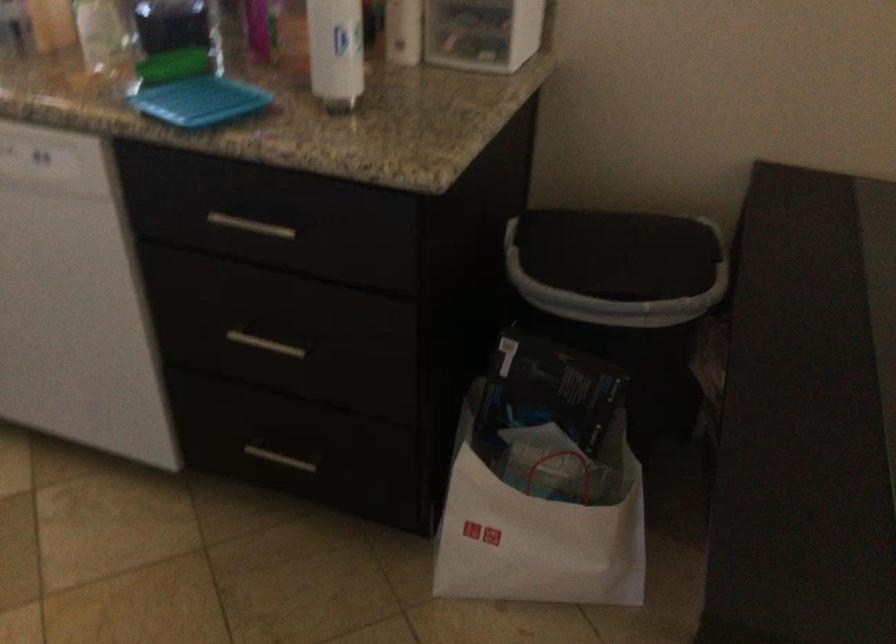
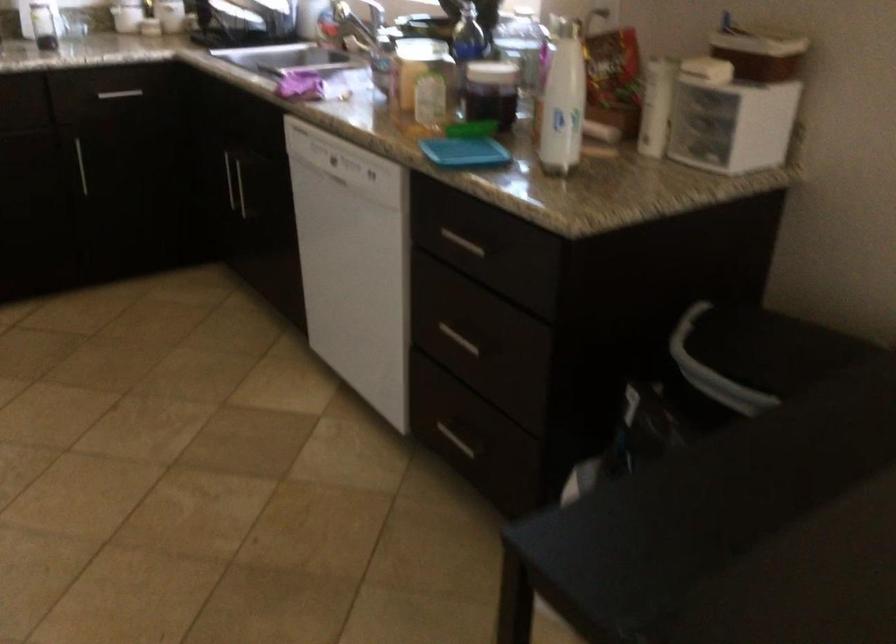
The point at (200, 106) is marked in the first image. Where is the corresponding point in the second image?

(464, 152)